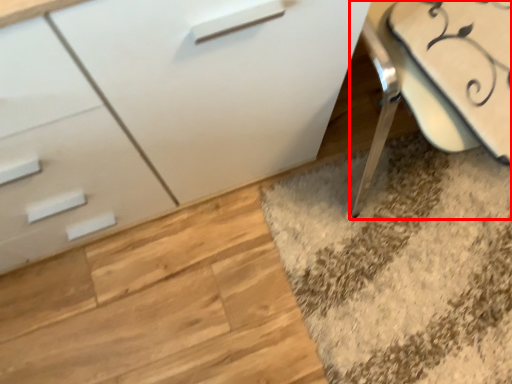
Question: From the image's perspective, what is the correct spatial positioning of swivel chair (annotated by the red box) in reference to chest of drawers?

Choices:
 (A) above
 (B) below

Answer: (A)